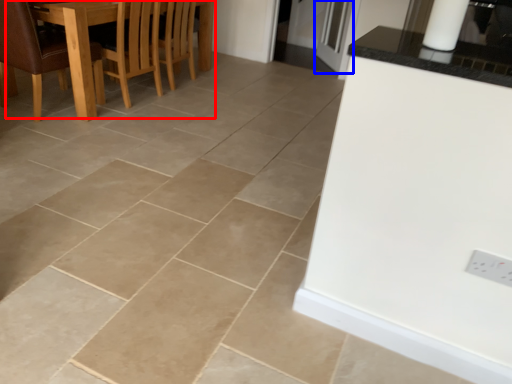
Question: Among these objects, which one is nearest to the camera, kitchen & dining room table (highlighted by a red box) or glass door (highlighted by a blue box)?

Choices:
 (A) kitchen & dining room table
 (B) glass door

Answer: (A)